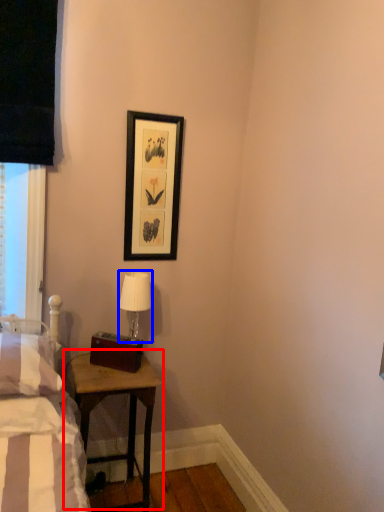
Question: Among these objects, which one is nearest to the camera, table (highlighted by a red box) or table lamp (highlighted by a blue box)?

Choices:
 (A) table
 (B) table lamp

Answer: (A)